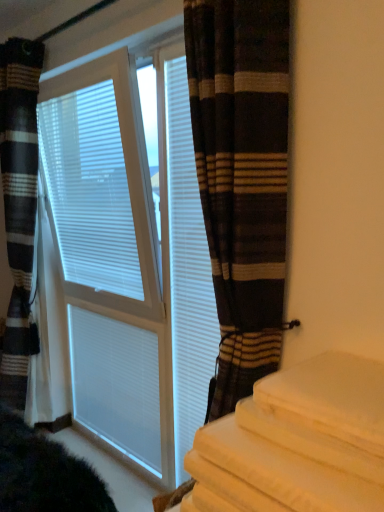
Locate an element on the screen. white textured blinds at center is located at coordinates (128, 261).

How much space does white matte shutter at center, which is the first shutter in back-to-front order, occupy vertically?

30.67 inches.

What do you see at coordinates (242, 179) in the screenshot? The image size is (384, 512). I see `brown striped curtain at center, which is counted as the 2th curtain, starting from the left` at bounding box center [242, 179].

Where is `brown striped curtain at center, the first curtain in the front-to-back sequence`? brown striped curtain at center, the first curtain in the front-to-back sequence is located at coordinates (242, 179).

What is the approximate width of white cotton bedding at lower right?

white cotton bedding at lower right is 18.69 inches wide.

This screenshot has height=512, width=384. What do you see at coordinates (100, 179) in the screenshot?
I see `white matte blinds at center` at bounding box center [100, 179].

What do you see at coordinates (187, 271) in the screenshot?
I see `white matte shutter at center, which appears as the 2th shutter when viewed from the left` at bounding box center [187, 271].

This screenshot has height=512, width=384. I want to click on white textured blinds at center, so click(x=128, y=261).

At what (x,y) coordinates should I click in order to perform the action: click on bay window located below the brown striped curtain at center, the first curtain in the front-to-back sequence (from the image's perspective). Please return your answer as a coordinate pair (x, y). This screenshot has height=512, width=384. Looking at the image, I should click on (128, 261).

Can brown striped curtain at center, which is counted as the 2th curtain, starting from the left, be found inside white textured blinds at center?

No, brown striped curtain at center, which is counted as the 2th curtain, starting from the left, is located outside of white textured blinds at center.

From a real-world perspective, is white textured blinds at center over brown striped curtain at center, the first curtain in the front-to-back sequence?

Incorrect, from a real-world perspective, white textured blinds at center is lower than brown striped curtain at center, the first curtain in the front-to-back sequence.

From the image's perspective, is white textured blinds at center located above brown striped curtain at center, which is counted as the second curtain, starting from the back?

Incorrect, from the image's perspective, white textured blinds at center is lower than brown striped curtain at center, which is counted as the second curtain, starting from the back.

Can you tell me how much white matte blinds at center and white matte shutter at center, placed as the first shutter when sorted from right to left, differ in facing direction?

They differ by 2.44 degrees in their facing directions.

From the image's perspective, is white matte blinds at center located above or below white matte shutter at center, which appears as the 2th shutter when viewed from the left?

Clearly, from the image's perspective, white matte blinds at center is above white matte shutter at center, which appears as the 2th shutter when viewed from the left.

Where is `window blind that appears above the white matte shutter at center, the 1th shutter in the front-to-back sequence (from a real-world perspective)`? window blind that appears above the white matte shutter at center, the 1th shutter in the front-to-back sequence (from a real-world perspective) is located at coordinates (100, 179).

Can you confirm if white matte blinds at center is smaller than white matte shutter at center, which appears as the 2th shutter when viewed from the left?

No, white matte blinds at center is not smaller than white matte shutter at center, which appears as the 2th shutter when viewed from the left.

Where is `the 2nd shutter counting from the left of the brown striped curtain at center, which is counted as the 2th curtain, starting from the left`? This screenshot has width=384, height=512. the 2nd shutter counting from the left of the brown striped curtain at center, which is counted as the 2th curtain, starting from the left is located at coordinates (117, 384).

Is brown striped curtain at center, which is counted as the 2th curtain, starting from the left, in contact with white matte shutter at center, which appears as the second shutter when viewed from the front?

No.

Is white matte shutter at center, acting as the second shutter starting from the right, a part of brown striped curtain at center, positioned as the 1th curtain in right-to-left order?

No, white matte shutter at center, acting as the second shutter starting from the right, is not a part of brown striped curtain at center, positioned as the 1th curtain in right-to-left order.

Does striped fabric curtain at left, the 2th curtain in the right-to-left sequence, have a smaller size compared to white matte blinds at center?

Actually, striped fabric curtain at left, the 2th curtain in the right-to-left sequence, might be larger than white matte blinds at center.

From a real-world perspective, is striped fabric curtain at left, the first curtain viewed from the back, physically above white matte blinds at center?

No.

From the image's perspective, count 1st curtains downward from the white matte blinds at center and point to it. Please provide its 2D coordinates.

[(19, 205)]

Is white cotton bedding at lower right completely or partially outside of striped fabric curtain at left, the first curtain viewed from the back?

Yes, white cotton bedding at lower right is not within striped fabric curtain at left, the first curtain viewed from the back.

From the image's perspective, is white cotton bedding at lower right located above striped fabric curtain at left, the 1th curtain in the left-to-right sequence?

No, from the image's perspective, white cotton bedding at lower right is not on top of striped fabric curtain at left, the 1th curtain in the left-to-right sequence.

Is white cotton bedding at lower right with striped fabric curtain at left, the 2th curtain in the right-to-left sequence?

No, white cotton bedding at lower right is not making contact with striped fabric curtain at left, the 2th curtain in the right-to-left sequence.

From a real-world perspective, is white textured blinds at center physically below striped fabric curtain at left, the first curtain viewed from the back?

Yes, from a real-world perspective, white textured blinds at center is beneath striped fabric curtain at left, the first curtain viewed from the back.

Which is behind, point (94, 374) or point (7, 350)?

The point (7, 350) is behind.

Can you tell me how much white textured blinds at center and striped fabric curtain at left, the 2th curtain in the right-to-left sequence, differ in facing direction?

5.74 degrees separate the facing orientations of white textured blinds at center and striped fabric curtain at left, the 2th curtain in the right-to-left sequence.

Considering the relative sizes of white textured blinds at center and striped fabric curtain at left, the first curtain viewed from the back, in the image provided, is white textured blinds at center shorter than striped fabric curtain at left, the first curtain viewed from the back,?

Correct, white textured blinds at center is not as tall as striped fabric curtain at left, the first curtain viewed from the back.

Considering the sizes of objects white matte shutter at center, placed as the first shutter when sorted from right to left, and white matte shutter at center, acting as the second shutter starting from the right, in the image provided, who is thinner, white matte shutter at center, placed as the first shutter when sorted from right to left, or white matte shutter at center, acting as the second shutter starting from the right,?

Thinner between the two is white matte shutter at center, acting as the second shutter starting from the right.

Between white matte shutter at center, which ranks as the second shutter in back-to-front order, and white matte shutter at center, which is the first shutter in back-to-front order, which one has larger size?

Bigger between the two is white matte shutter at center, which ranks as the second shutter in back-to-front order.

In the image, is white matte shutter at center, placed as the first shutter when sorted from right to left, positioned in front of or behind white matte shutter at center, which appears as the second shutter when viewed from the front?

white matte shutter at center, placed as the first shutter when sorted from right to left, is in front of white matte shutter at center, which appears as the second shutter when viewed from the front.

From the picture: Is white matte shutter at center, which ranks as the second shutter in back-to-front order, taller than white matte shutter at center, which is the first shutter in back-to-front order?

Yes.

Where is `bay window located underneath the brown striped curtain at center, positioned as the 1th curtain in right-to-left order (from a real-world perspective)`? This screenshot has height=512, width=384. bay window located underneath the brown striped curtain at center, positioned as the 1th curtain in right-to-left order (from a real-world perspective) is located at coordinates (128, 261).

Locate an element on the screen. shutter in front of the white matte blinds at center is located at coordinates (187, 271).

Estimate the real-world distances between objects in this image. Which object is closer to brown striped curtain at center, which is counted as the second curtain, starting from the back, white textured blinds at center or white matte blinds at center?

white textured blinds at center is positioned closer to the anchor brown striped curtain at center, which is counted as the second curtain, starting from the back.

When comparing their distances from brown striped curtain at center, which is counted as the second curtain, starting from the back, does white matte shutter at center, which is the first shutter in back-to-front order, or white matte blinds at center seem further?

white matte shutter at center, which is the first shutter in back-to-front order.

Based on the photo, estimate the real-world distances between objects in this image. Which object is closer to white matte shutter at center, which appears as the 2th shutter when viewed from the left, brown striped curtain at center, which is counted as the second curtain, starting from the back, or white textured blinds at center?

white textured blinds at center.

Which object lies nearer to the anchor point white cotton bedding at lower right, striped fabric curtain at left, the 2th curtain in the right-to-left sequence, or white matte shutter at center, which appears as the second shutter when viewed from the front?

white matte shutter at center, which appears as the second shutter when viewed from the front, lies closer to white cotton bedding at lower right than the other object.

Which object lies nearer to the anchor point white textured blinds at center, striped fabric curtain at left, which appears as the 2th curtain when viewed from the front, or white matte shutter at center, acting as the second shutter starting from the right?

The object closer to white textured blinds at center is white matte shutter at center, acting as the second shutter starting from the right.

Estimate the real-world distances between objects in this image. Which object is further from white matte shutter at center, acting as the second shutter starting from the right, brown striped curtain at center, which is counted as the 2th curtain, starting from the left, or white textured blinds at center?

Among the two, brown striped curtain at center, which is counted as the 2th curtain, starting from the left, is located further to white matte shutter at center, acting as the second shutter starting from the right.

Looking at the image, which one is located further to white matte shutter at center, which ranks as the second shutter in back-to-front order, white matte shutter at center, which appears as the second shutter when viewed from the front, or striped fabric curtain at left, the 2th curtain in the right-to-left sequence?

Among the two, striped fabric curtain at left, the 2th curtain in the right-to-left sequence, is located further to white matte shutter at center, which ranks as the second shutter in back-to-front order.

Estimate the real-world distances between objects in this image. Which object is further from brown striped curtain at center, which is counted as the second curtain, starting from the back, white matte shutter at center, which appears as the 2th shutter when viewed from the left, or white textured blinds at center?

white textured blinds at center is further to brown striped curtain at center, which is counted as the second curtain, starting from the back.

Locate an element on the screen. curtain between white cotton bedding at lower right and white matte blinds at center in the front-back direction is located at coordinates (242, 179).

Where is `window blind between white cotton bedding at lower right and white matte shutter at center, which is the first shutter in back-to-front order, in the front-back direction`? window blind between white cotton bedding at lower right and white matte shutter at center, which is the first shutter in back-to-front order, in the front-back direction is located at coordinates (100, 179).

Locate an element on the screen. The image size is (384, 512). curtain located between white cotton bedding at lower right and white matte shutter at center, placed as the first shutter when sorted from right to left, in the depth direction is located at coordinates (242, 179).

Where is `bay window located between white matte blinds at center and white matte shutter at center, the 1th shutter in the front-to-back sequence, in the left-right direction`? This screenshot has height=512, width=384. bay window located between white matte blinds at center and white matte shutter at center, the 1th shutter in the front-to-back sequence, in the left-right direction is located at coordinates (128, 261).